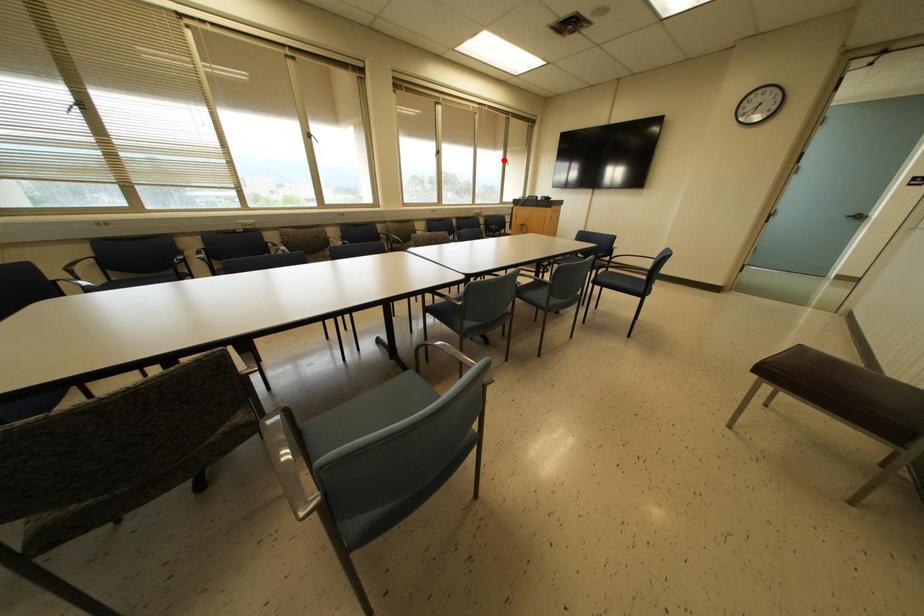
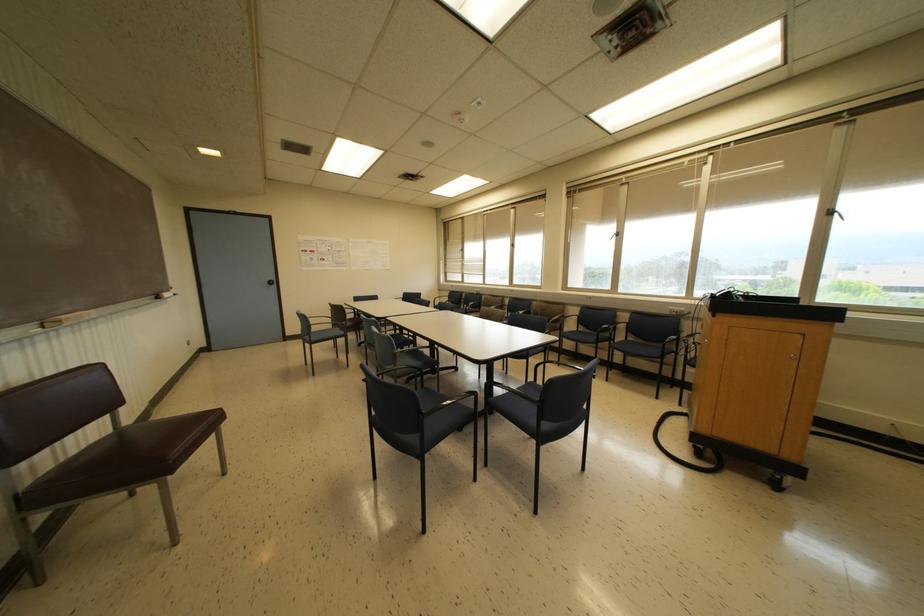
Question: I am providing you with two images of the same scene from different viewpoints. Image1 has a red point marked. In image2, the corresponding 3D location appears at what relative position? Reply with the corresponding letter.

Choices:
 (A) Closer
 (B) Farther

Answer: (B)